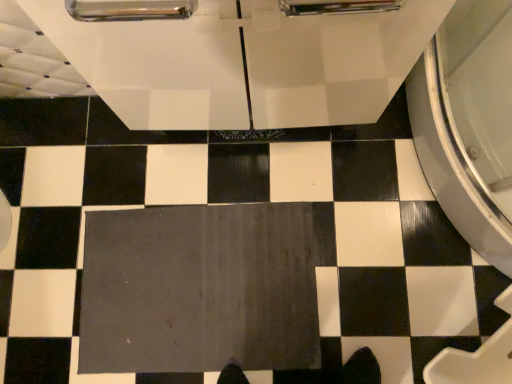
Locate an element on the screen. Image resolution: width=512 pixels, height=384 pixels. free location to the right of dark gray rubber bath mat at center is located at coordinates (366, 246).